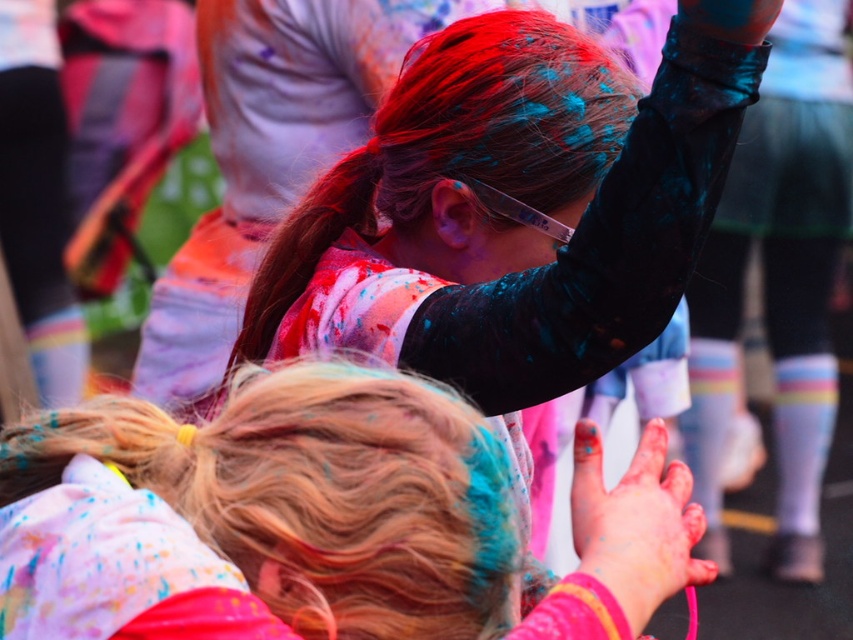
Question: Is shiny red hair at upper center to the right of painted skin hand at center from the viewer's perspective?

Choices:
 (A) no
 (B) yes

Answer: (A)

Question: Among these points, which one is farthest from the camera?

Choices:
 (A) (589, 177)
 (B) (321, 586)
 (C) (587, 497)

Answer: (A)

Question: Is blonde hair at center smaller than shiny red hair at upper center?

Choices:
 (A) no
 (B) yes

Answer: (A)

Question: Which point is closer to the camera taking this photo?

Choices:
 (A) (305, 220)
 (B) (390, 604)
 (C) (651, 513)

Answer: (B)

Question: Is blonde hair at center closer to the viewer compared to shiny red hair at upper center?

Choices:
 (A) yes
 (B) no

Answer: (A)

Question: Considering the real-world distances, which object is farthest from the painted skin hand at center?

Choices:
 (A) shiny red hair at upper center
 (B) blonde hair at center

Answer: (A)